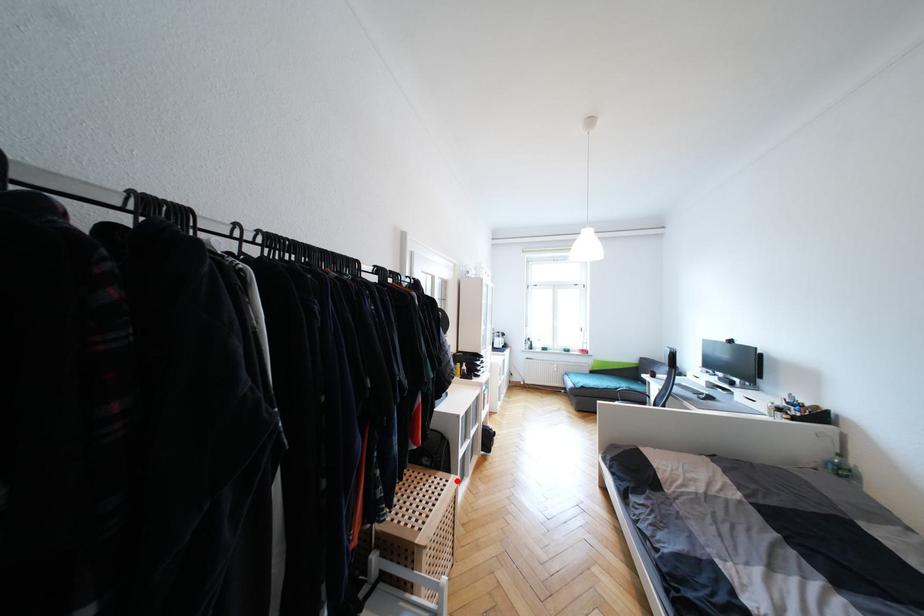
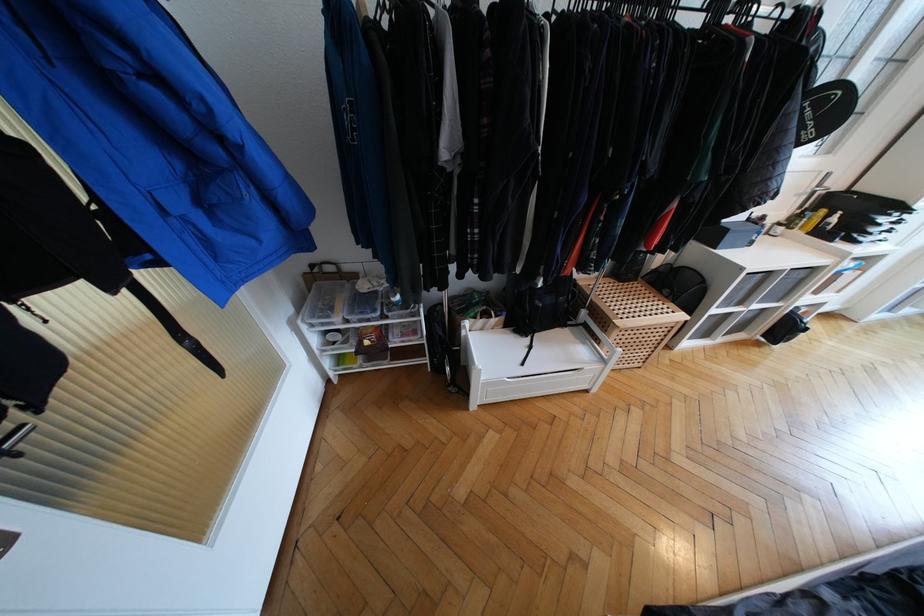
Question: A red point is marked in image1. In image2, is the corresponding 3D point closer to the camera or farther? Reply with the corresponding letter.

Choices:
 (A) The corresponding 3D point is closer.
 (B) The corresponding 3D point is farther.

Answer: (B)